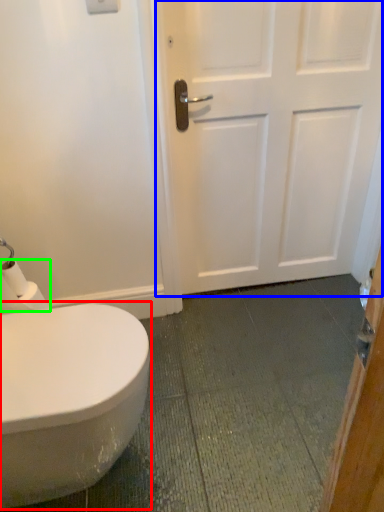
Question: Based on their relative distances, which object is nearer to bidet (highlighted by a red box)? Choose from door (highlighted by a blue box) and toilet paper (highlighted by a green box).

Choices:
 (A) door
 (B) toilet paper

Answer: (B)